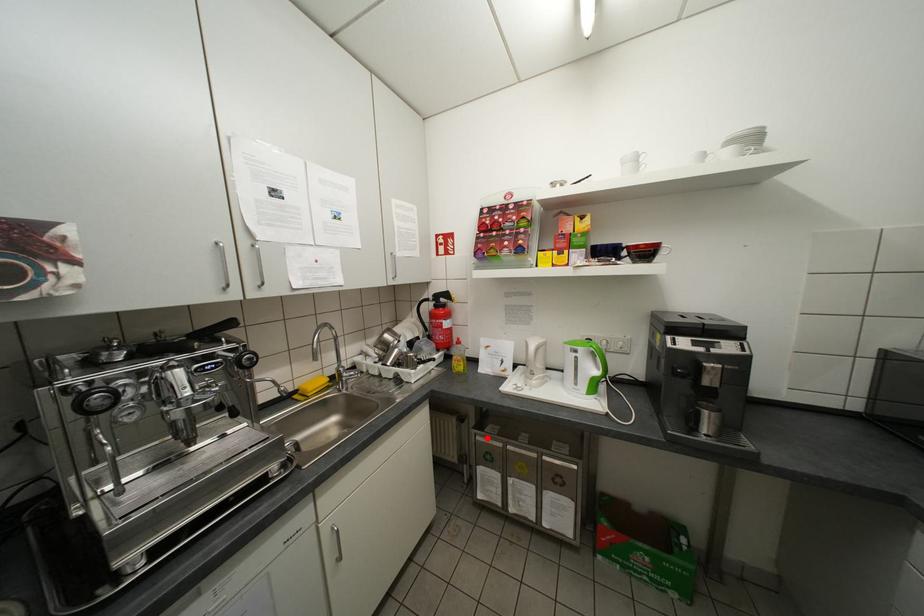
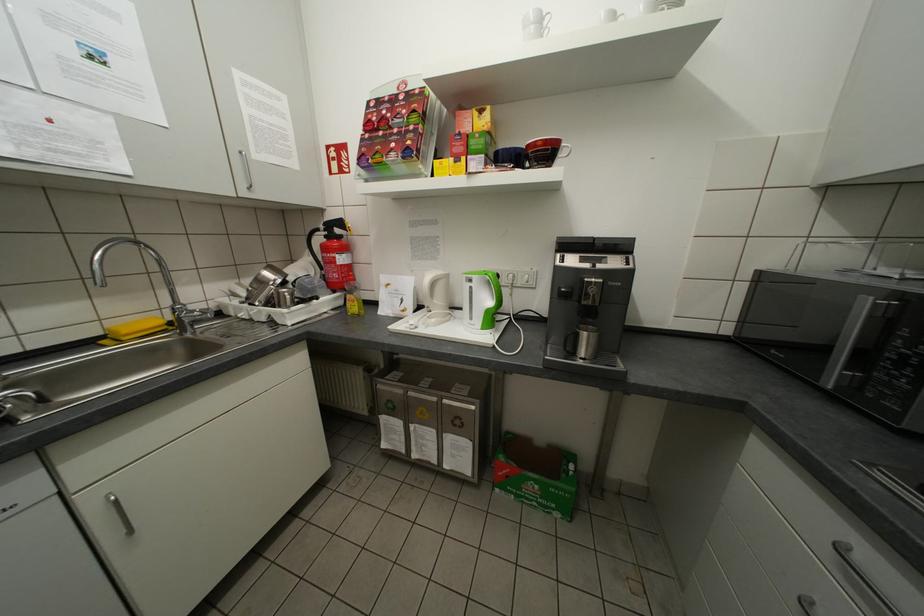
The point at the highlighted location is marked in the first image. Where is the corresponding point in the second image?

(387, 387)